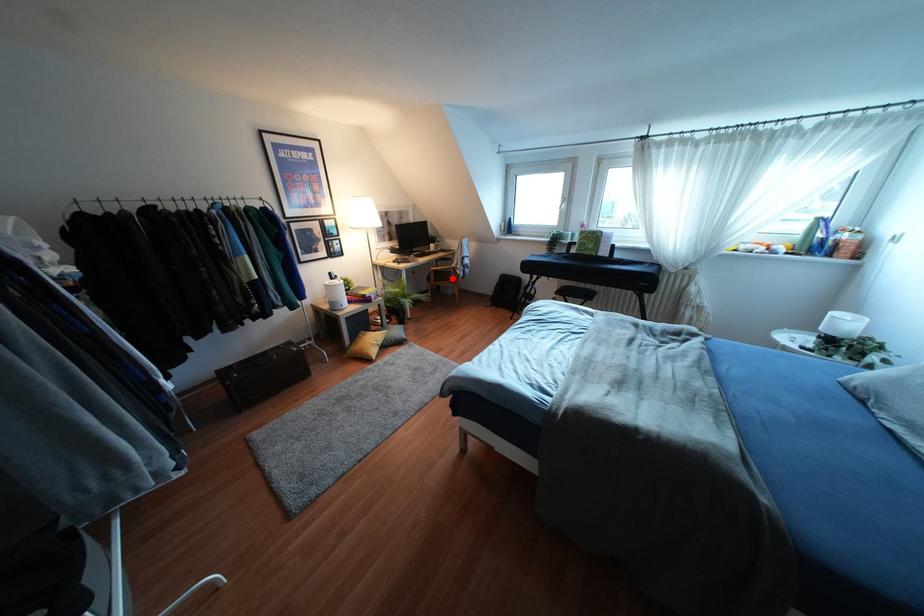
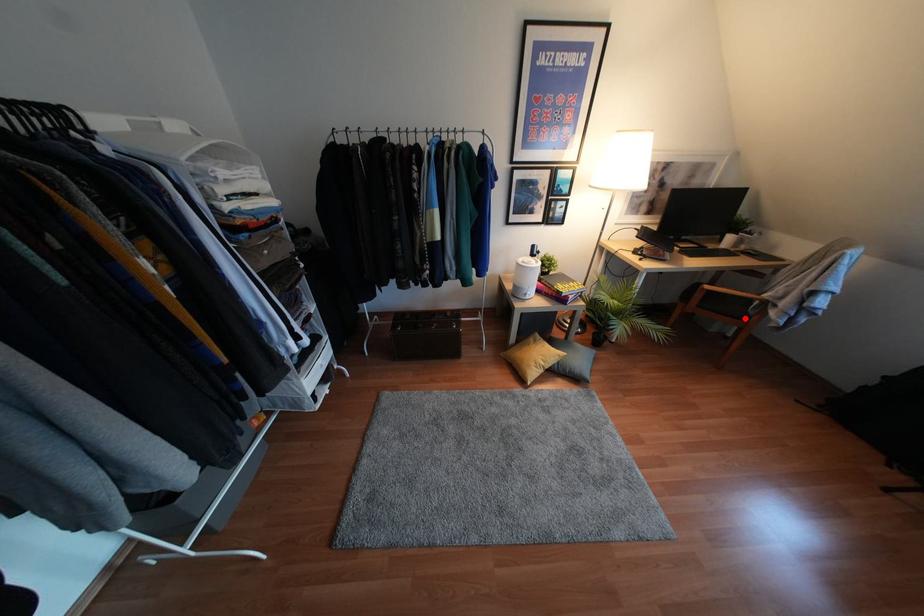
I am providing you with two images of the same scene from different viewpoints. A red point is marked on the first image and another point is marked on the second image. Are the points marked in image1 and image2 representing the same 3D position?

Yes